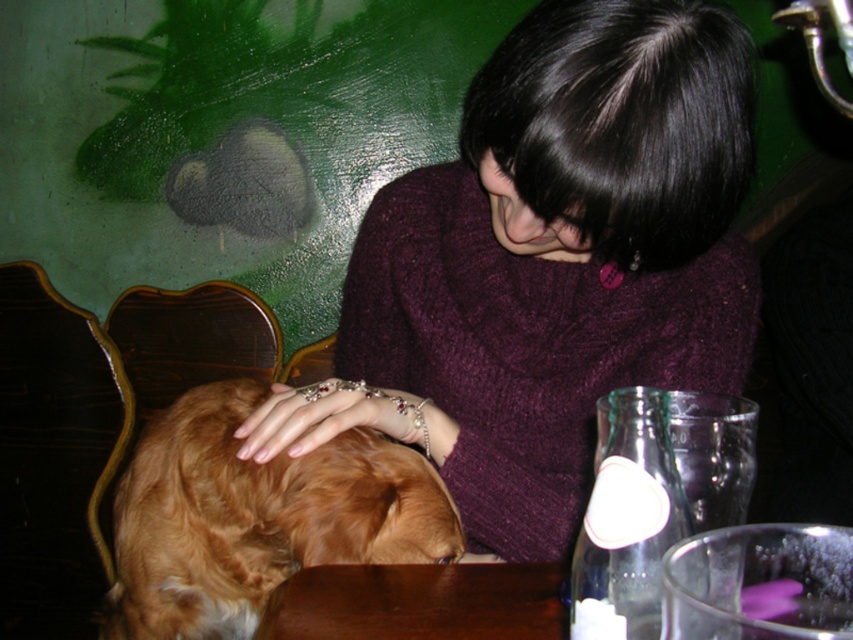
Question: Is purple knitted sweater at center above brown fluffy dog at lower left?

Choices:
 (A) no
 (B) yes

Answer: (B)

Question: Is purple knitted sweater at center below brown fluffy dog at lower left?

Choices:
 (A) no
 (B) yes

Answer: (A)

Question: In this image, where is purple knitted sweater at center located relative to brown fluffy dog at lower left?

Choices:
 (A) below
 (B) above

Answer: (B)